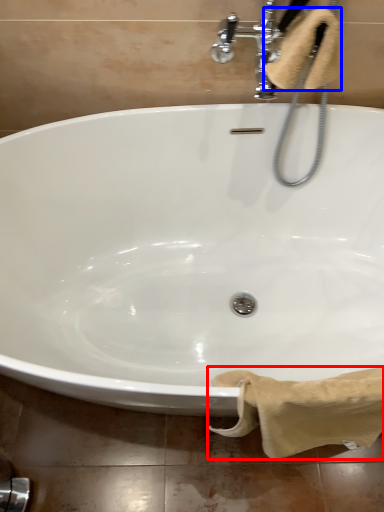
Question: Which object is further to the camera taking this photo, bath towel (highlighted by a red box) or bath towel (highlighted by a blue box)?

Choices:
 (A) bath towel
 (B) bath towel

Answer: (B)